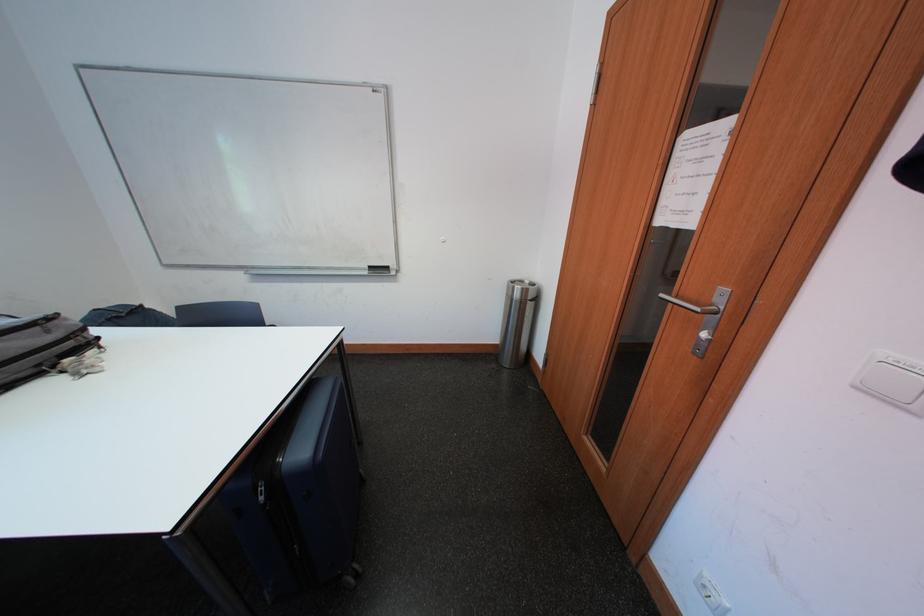
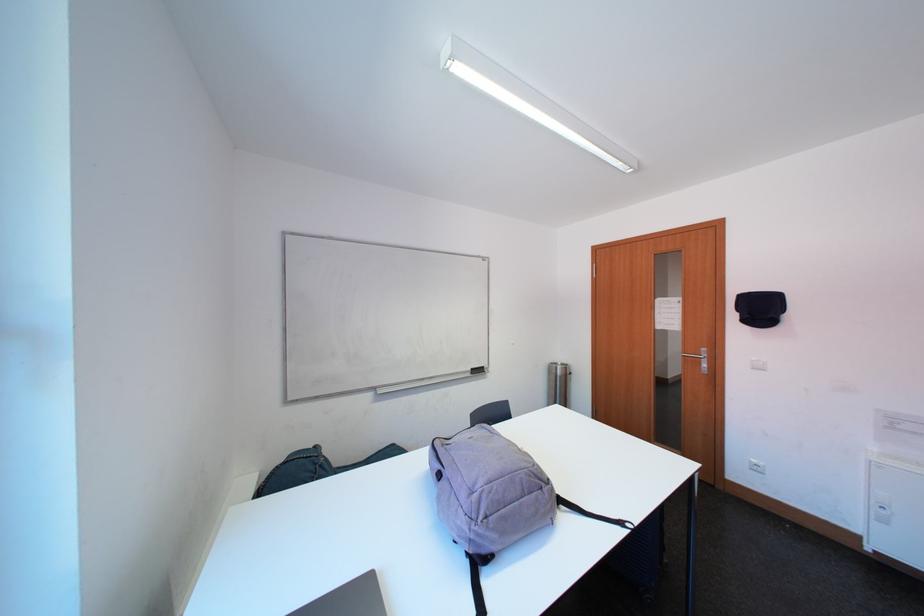
Find the pixel in the second image that matches (x=523, y=291) in the first image.

(565, 371)